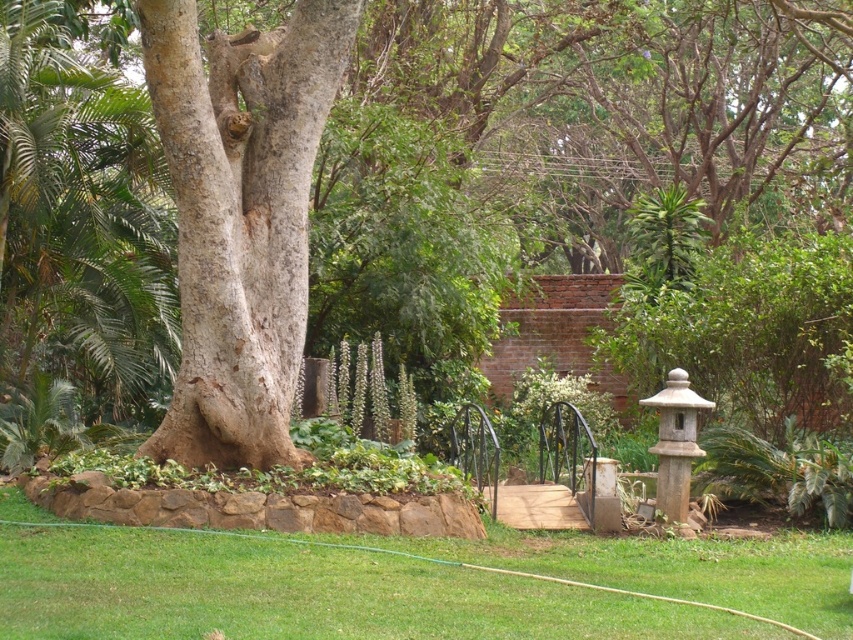
Question: Is rough bark tree at center closer to the viewer compared to green grass at lower center?

Choices:
 (A) no
 (B) yes

Answer: (A)

Question: Is rough bark tree at center wider than brown wrought iron bridge at center?

Choices:
 (A) no
 (B) yes

Answer: (B)

Question: Considering the real-world distances, which object is closest to the green grass at lower center?

Choices:
 (A) smooth gray bark at center
 (B) rough bark tree at center

Answer: (A)

Question: Considering the real-world distances, which object is closest to the rough bark tree at center?

Choices:
 (A) green grass at lower center
 (B) brown wrought iron bridge at center
 (C) smooth gray bark at center

Answer: (C)

Question: Which point is farther to the camera?

Choices:
 (A) green grass at lower center
 (B) rough bark tree at center

Answer: (B)

Question: Does rough bark tree at center appear under brown wrought iron bridge at center?

Choices:
 (A) no
 (B) yes

Answer: (A)